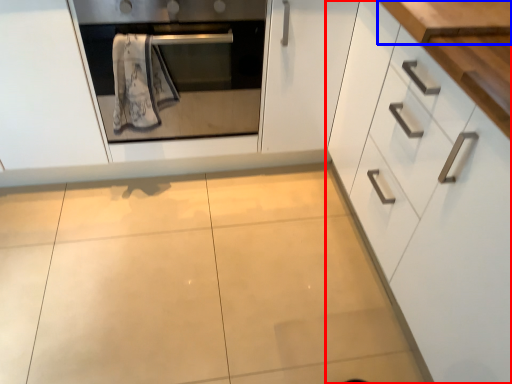
Question: Among these objects, which one is farthest to the camera, cabinetry (highlighted by a red box) or counter top (highlighted by a blue box)?

Choices:
 (A) cabinetry
 (B) counter top

Answer: (B)